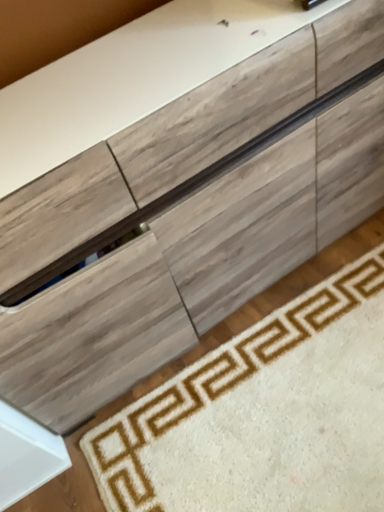
What do you see at coordinates (264, 414) in the screenshot? I see `white woolen doormat at lower center` at bounding box center [264, 414].

The image size is (384, 512). Identify the location of white woolen doormat at lower center. (264, 414).

Locate an element on the screen. This screenshot has width=384, height=512. white woolen doormat at lower center is located at coordinates (264, 414).